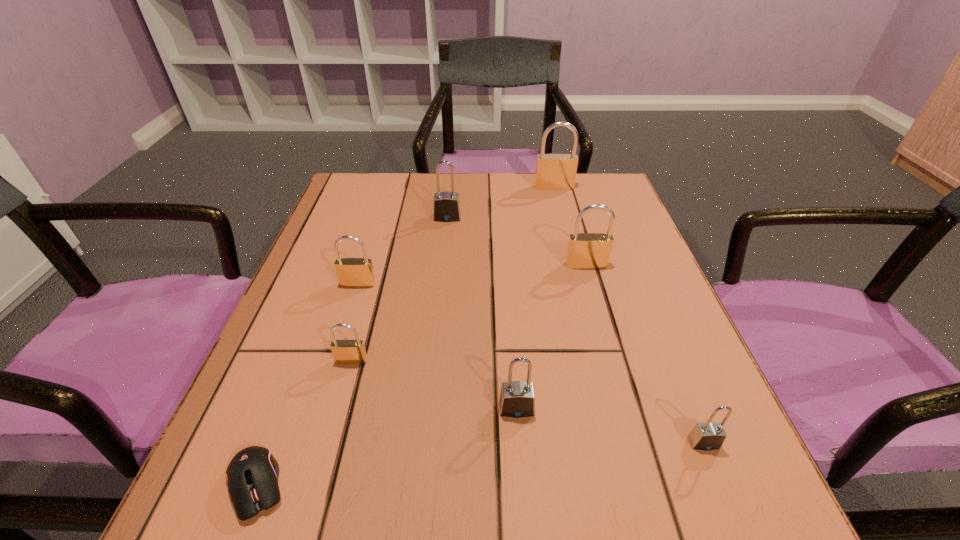
What are the coordinates of `free space at the right edge of the desktop` in the screenshot? It's located at (703, 382).

I want to click on vacant region at the far left corner of the desktop, so click(360, 204).

Image resolution: width=960 pixels, height=540 pixels. In the image, there is a desktop. In order to click on vacant space at the near left corner in this screenshot , I will do `click(212, 516)`.

Image resolution: width=960 pixels, height=540 pixels. I want to click on blank area at the far right corner, so click(x=579, y=180).

The width and height of the screenshot is (960, 540). Find the location of `free space at the near right corner of the desktop`. free space at the near right corner of the desktop is located at coordinates (660, 477).

The image size is (960, 540). What are the coordinates of `blank region between the tallest padlock and the third padlock from left to right` in the screenshot? It's located at (500, 202).

At what (x,y) coordinates should I click in order to perform the action: click on unoccupied position between the third farthest object and the seventh farthest object. Please return your answer as a coordinate pair (x, y). The width and height of the screenshot is (960, 540). Looking at the image, I should click on (645, 354).

Locate an element on the screen. The image size is (960, 540). free spot between the fourth nearest padlock and the fifth farthest object is located at coordinates (355, 322).

Find the location of a particular element. Image resolution: width=960 pixels, height=540 pixels. free space between the computer mouse and the fourth nearest object is located at coordinates (304, 423).

Find the location of a particular element. vacant area between the sixth nearest padlock and the second farthest gray padlock is located at coordinates (482, 313).